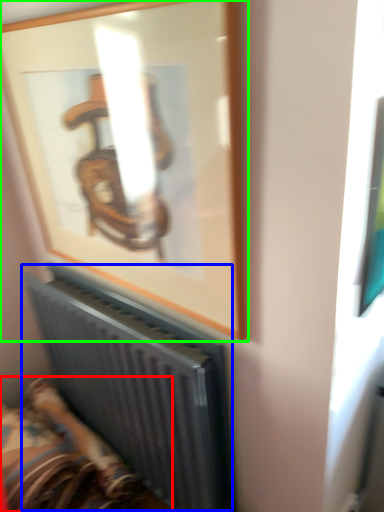
Question: Which object is positioned closest to furniture (highlighted by a red box)? Select from radiator (highlighted by a blue box) and picture frame (highlighted by a green box).

Choices:
 (A) radiator
 (B) picture frame

Answer: (A)